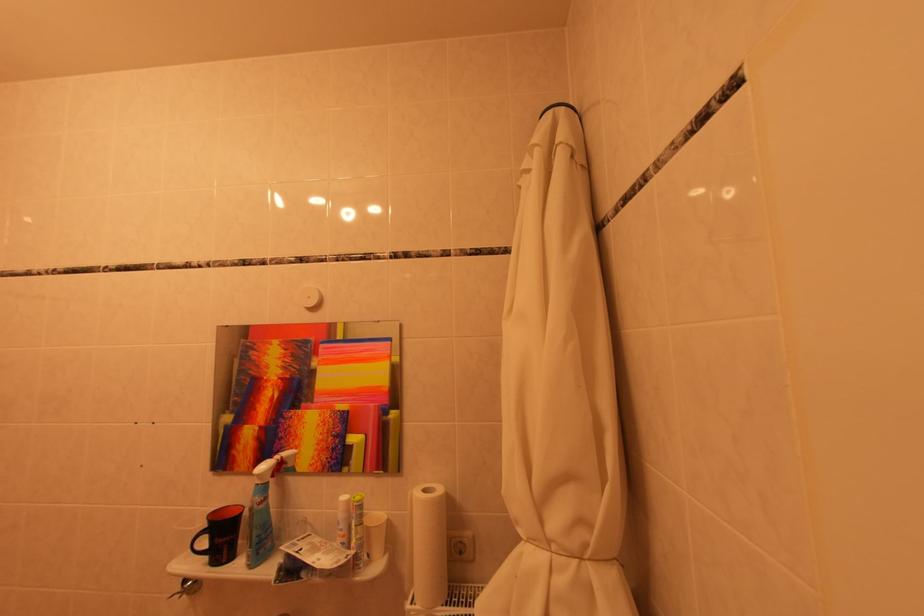
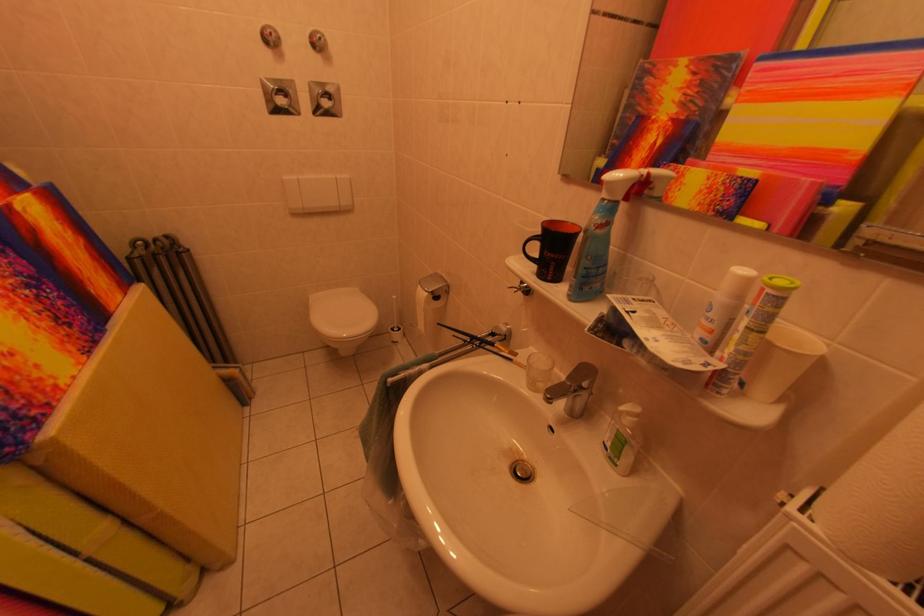
In the second image, find the point that corresponds to (x=362, y=556) in the first image.

(732, 370)